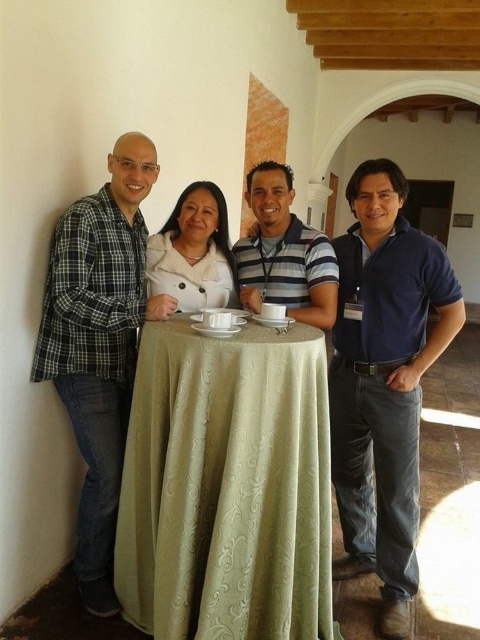
From the picture: You are a photographer standing at a certain distance from the green textured tablecloth at center. You want to take a closeup shot of it without moving the camera. What should you do?

You should zoom in on the green textured tablecloth at center since it is 1.76 meters away from the camera, which may require adjusting the zoom to capture a closeup without moving the camera position.

Where is the green textured tablecloth at center located in the image?

The green textured tablecloth at center is located at point coordinates of (227, 486).

You are a photographer trying to arrange two people for a photo. You have a green plaid shirt at left and a striped cotton shirt at center. If you want to make sure the shorter person is in the front, which shirt should you place in front?

The striped cotton shirt at center should be placed in front because it is shorter than the green plaid shirt at left.